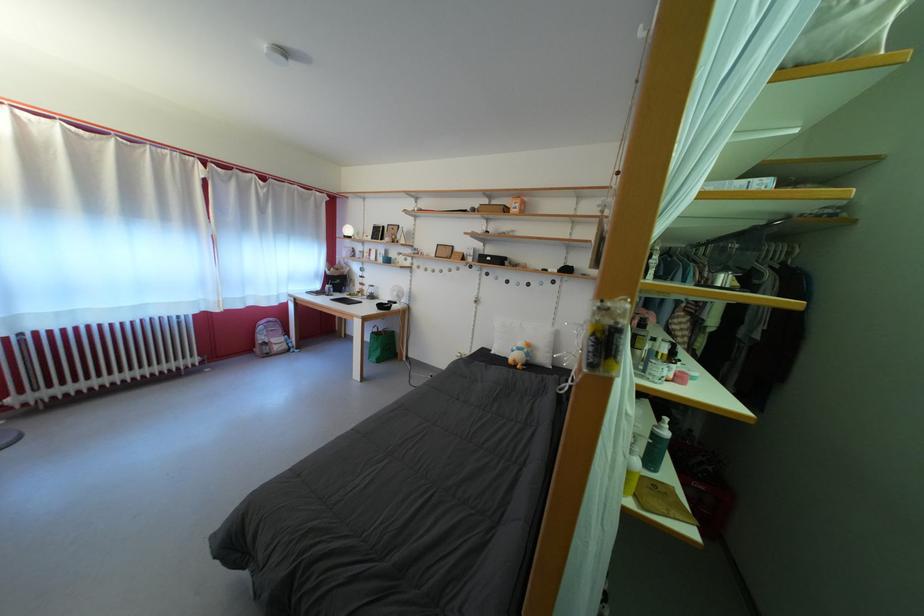
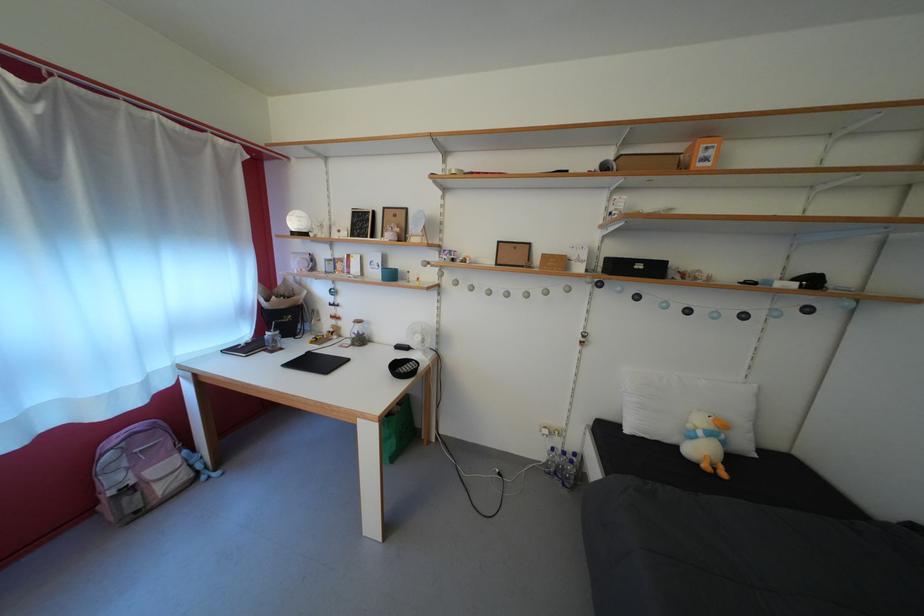
In the second image, find the point that corresponds to pixel 271 344 in the first image.

(123, 485)